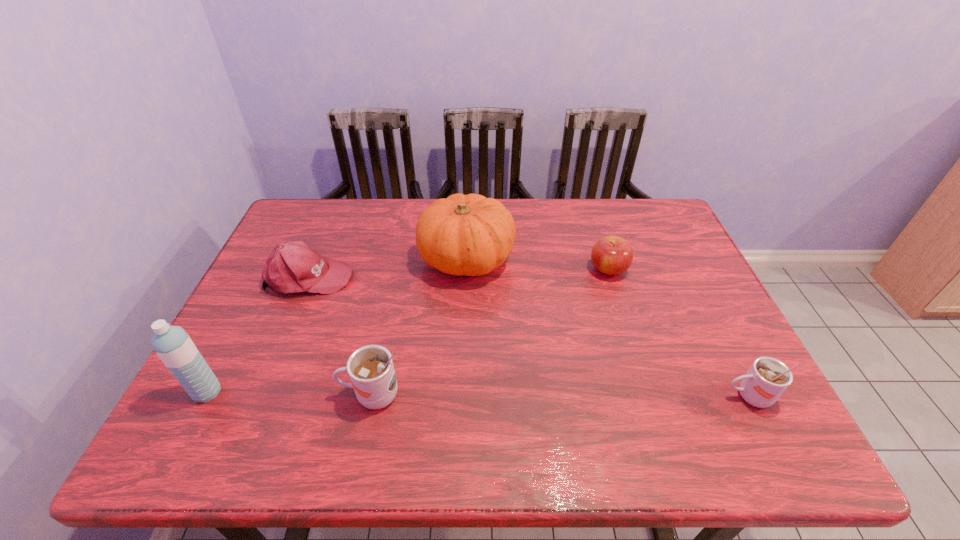
Locate an element on the screen. vacant region located on the side with the handle of the fourth shortest object is located at coordinates (294, 395).

What are the coordinates of `vacant space located 0.230m on the side with the handle of the shorter cup` in the screenshot? It's located at (619, 396).

Where is `free space located 0.390m on the side with the handle of the shorter cup`? This screenshot has width=960, height=540. free space located 0.390m on the side with the handle of the shorter cup is located at coordinates tap(546, 396).

Identify the location of free space located on the side with the handle of the shorter cup. This screenshot has height=540, width=960. (655, 396).

Where is `free space located on the left of the pumpkin`? free space located on the left of the pumpkin is located at coordinates (375, 258).

Identify the location of free region located at the front of the baseball cap with the brim. (444, 277).

The width and height of the screenshot is (960, 540). Find the location of `free location located on the front of the apple`. free location located on the front of the apple is located at coordinates (649, 399).

The image size is (960, 540). What are the coordinates of `vacant area located on the back of the tallest object` in the screenshot? It's located at (227, 355).

At what (x,y) coordinates should I click in order to perform the action: click on object present at the far edge. Please return your answer as a coordinate pair (x, y). This screenshot has width=960, height=540. Looking at the image, I should click on (471, 235).

Find the location of a particular element. water bottle that is at the near edge is located at coordinates (172, 344).